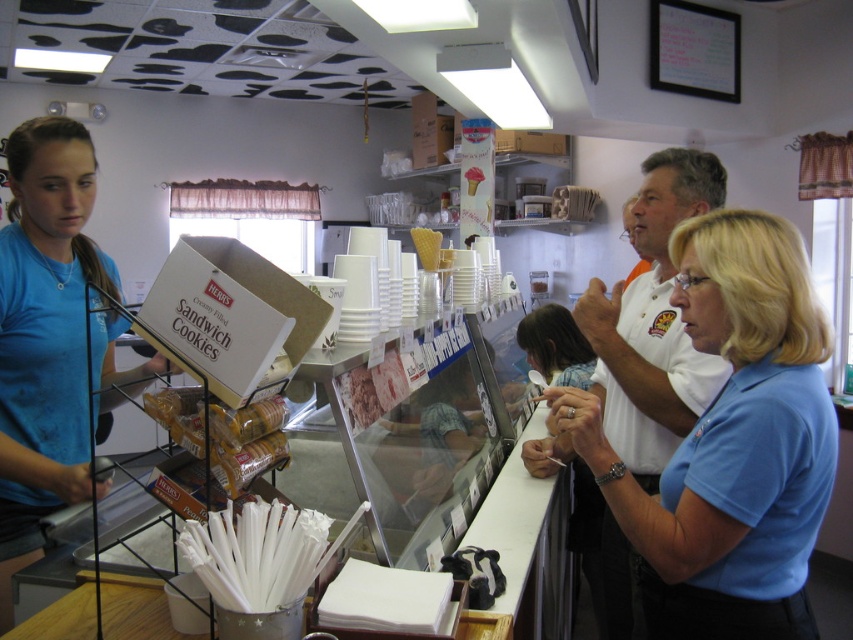
You are a customer in the ice cream shop and want to place an order. Where should you approach to find the blue cotton shirt at center?

The blue cotton shirt at center is located at point (732,444), so you should approach the center area near the counter where the young woman is standing to place your order.